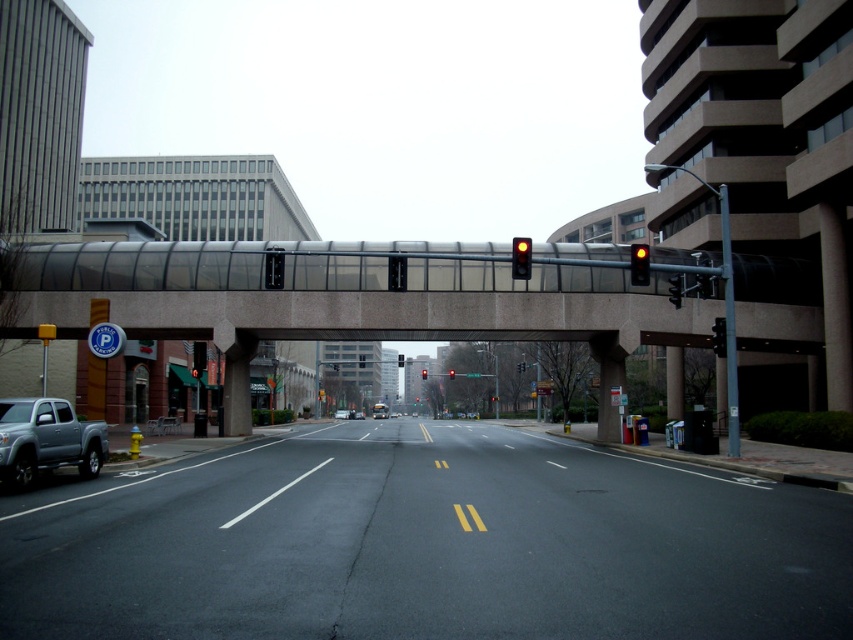
You are a delivery driver who needs to park your vehicle near the Public Parking sign. You see a metallic traffic light at center and a yellow glass traffic light at upper center. Which traffic light is closer to your current position?

The metallic traffic light at center is closer to your current position since it has a smaller size compared to the yellow glass traffic light at upper center, indicating it is nearer.

You are a delivery driver approaching the intersection and need to determine which traffic light is closer to you. The scene has a metallic traffic light at center and a yellow matte traffic light at center. Which one is nearer?

The metallic traffic light at center is closer to the viewer than the yellow matte traffic light at center, so the metallic traffic light at center is nearer.

In the scene shown: You are a delivery driver who needs to turn left onto the road where the parked silver pickup truck is located. The traffic light at center is at point (274, 268). Can you safely make the turn without crossing the yellow double lines?

The metallic traffic light at center is located at point (274, 268). Since the yellow double lines are in the center of the road, you can safely turn left onto the road where the parked silver pickup truck is located without crossing the yellow double lines as long as you stay in your lane.